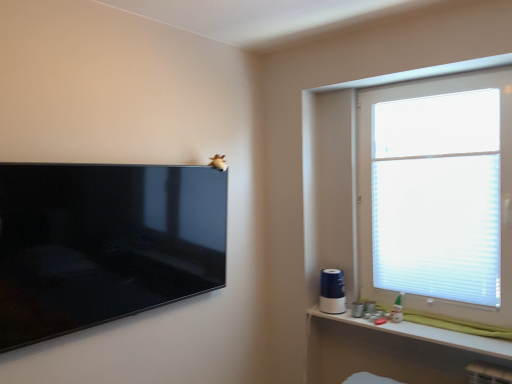
Question: Is the depth of white translucent blinds at upper right less than that of matte black tv at upper left?

Choices:
 (A) no
 (B) yes

Answer: (A)

Question: Considering the relative sizes of white translucent blinds at upper right and matte black tv at upper left in the image provided, is white translucent blinds at upper right wider than matte black tv at upper left?

Choices:
 (A) yes
 (B) no

Answer: (B)

Question: Does white translucent blinds at upper right have a greater height compared to matte black tv at upper left?

Choices:
 (A) yes
 (B) no

Answer: (A)

Question: From the image's perspective, does white translucent blinds at upper right appear lower than matte black tv at upper left?

Choices:
 (A) no
 (B) yes

Answer: (A)

Question: Is white translucent blinds at upper right at the left side of matte black tv at upper left?

Choices:
 (A) no
 (B) yes

Answer: (A)

Question: Considering the positions of point (399, 253) and point (414, 334), is point (399, 253) closer or farther from the camera than point (414, 334)?

Choices:
 (A) farther
 (B) closer

Answer: (A)

Question: From the image's perspective, is white translucent blinds at upper right located above or below white plastic shelf at lower right?

Choices:
 (A) above
 (B) below

Answer: (A)

Question: From their relative heights in the image, would you say white translucent blinds at upper right is taller or shorter than white plastic shelf at lower right?

Choices:
 (A) tall
 (B) short

Answer: (A)

Question: Is white translucent blinds at upper right to the left or to the right of white plastic shelf at lower right in the image?

Choices:
 (A) right
 (B) left

Answer: (A)

Question: Looking at their shapes, would you say matte black tv at upper left is wider or thinner than white plastic shelf at lower right?

Choices:
 (A) thin
 (B) wide

Answer: (A)

Question: From a real-world perspective, is matte black tv at upper left positioned above or below white plastic shelf at lower right?

Choices:
 (A) below
 (B) above

Answer: (B)

Question: Is point (18, 284) closer or farther from the camera than point (429, 334)?

Choices:
 (A) closer
 (B) farther

Answer: (A)

Question: In the image, is matte black tv at upper left positioned in front of or behind white plastic shelf at lower right?

Choices:
 (A) behind
 (B) front

Answer: (B)

Question: Looking at their shapes, would you say white plastic shelf at lower right is wider or thinner than white translucent blinds at upper right?

Choices:
 (A) wide
 (B) thin

Answer: (A)

Question: From their relative heights in the image, would you say white plastic shelf at lower right is taller or shorter than white translucent blinds at upper right?

Choices:
 (A) tall
 (B) short

Answer: (B)